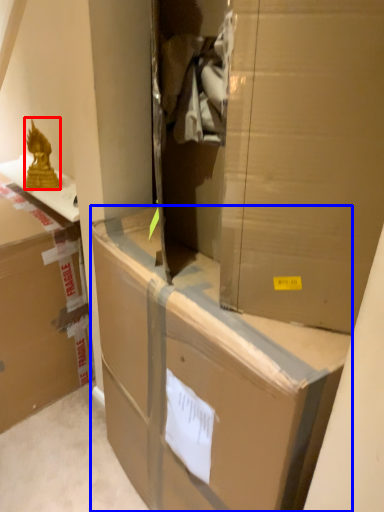
Question: Among these objects, which one is nearest to the camera, wrap (highlighted by a red box) or box (highlighted by a blue box)?

Choices:
 (A) wrap
 (B) box

Answer: (B)